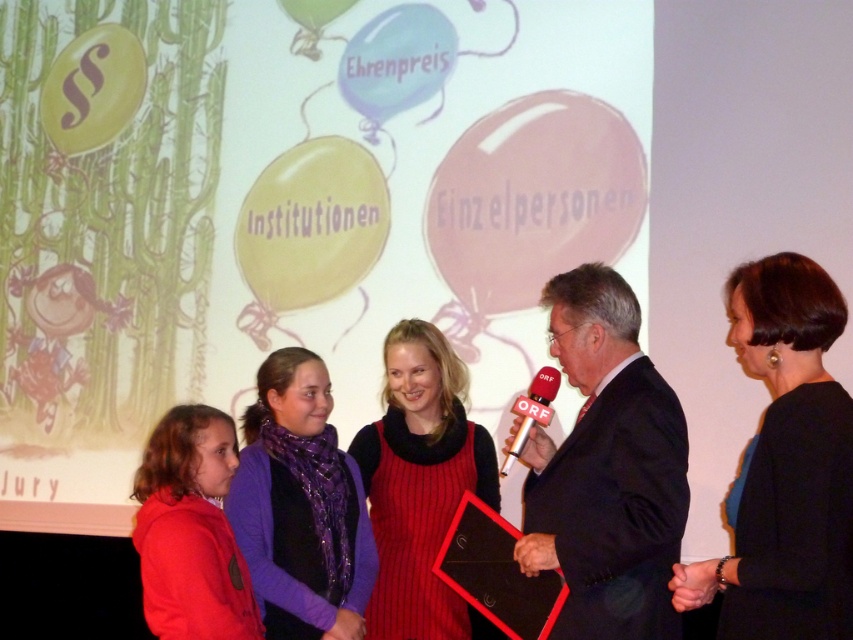
Question: Considering the relative positions of black satin dress at center and matte red dress at center in the image provided, where is black satin dress at center located with respect to matte red dress at center?

Choices:
 (A) right
 (B) left

Answer: (A)

Question: Can you confirm if purple shiny scarf at center is bigger than matte red dress at center?

Choices:
 (A) yes
 (B) no

Answer: (B)

Question: Estimate the real-world distances between objects in this image. Which object is farther from the matte red dress at center?

Choices:
 (A) black suit at center
 (B) red plastic microphone at center
 (C) purple shiny scarf at center
 (D) black satin dress at center

Answer: (D)

Question: Which object is positioned closest to the black satin dress at center?

Choices:
 (A) red plastic microphone at center
 (B) purple shiny scarf at center
 (C) matte red dress at center
 (D) black suit at center

Answer: (D)

Question: From the image, what is the correct spatial relationship of purple shiny scarf at center in relation to red fleece jacket at lower left?

Choices:
 (A) left
 (B) right

Answer: (B)

Question: Which point is closer to the camera?

Choices:
 (A) matte red dress at center
 (B) red fleece jacket at lower left

Answer: (B)